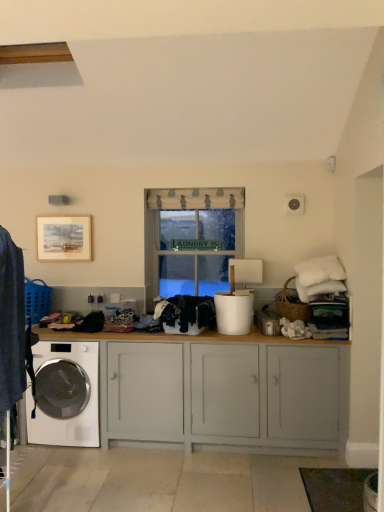
In order to face black cotton clothes at center, which appears as the second clothing when viewed from the left, should I rotate leftwards or rightwards?

Turn left by 1.363 degrees to look at black cotton clothes at center, which appears as the second clothing when viewed from the left.

Where is `white glossy washing machine at lower left`? This screenshot has width=384, height=512. white glossy washing machine at lower left is located at coordinates (81, 412).

Measure the distance between white glossy washing machine at lower left and camera.

The depth of white glossy washing machine at lower left is 10.74 feet.

Locate an element on the screen. denim jacket at left, the first clothing when ordered from front to back is located at coordinates (11, 322).

Identify the location of white fabric at center. (191, 240).

Locate an element on the screen. black cotton clothes at center, the 2th clothing from the front is located at coordinates (186, 314).

Is white glossy washing machine at lower left at the back of matte paper picture frame at upper left?

matte paper picture frame at upper left is not turned away from white glossy washing machine at lower left.

Based on the photo, from a real-world perspective, which object rests below the other?

white glossy washing machine at lower left.

Can you confirm if matte paper picture frame at upper left is smaller than white glossy washing machine at lower left?

Correct, matte paper picture frame at upper left occupies less space than white glossy washing machine at lower left.

Is white painted wood cabinet at center turned away from denim jacket at left, marked as the 1th clothing in a left-to-right arrangement?

white painted wood cabinet at center does not have its back to denim jacket at left, marked as the 1th clothing in a left-to-right arrangement.

From a real-world perspective, count 2nd clothings upward from the white painted wood cabinet at center and point to it. Please provide its 2D coordinates.

[(11, 322)]

Who is bigger, white painted wood cabinet at center or denim jacket at left, the 2th clothing positioned from the right?

With larger size is white painted wood cabinet at center.

Considering the positions of objects white painted wood cabinet at center and denim jacket at left, the first clothing when ordered from front to back, in the image provided, who is more to the left, white painted wood cabinet at center or denim jacket at left, the first clothing when ordered from front to back,?

From the viewer's perspective, denim jacket at left, the first clothing when ordered from front to back, appears more on the left side.

Is denim jacket at left, marked as the 1th clothing in a left-to-right arrangement, at the back of white fabric at center?

Result: No, white fabric at center is not facing the opposite direction of denim jacket at left, marked as the 1th clothing in a left-to-right arrangement.

In the image, is white fabric at center positioned in front of or behind denim jacket at left, marked as the 1th clothing in a left-to-right arrangement?

white fabric at center is behind denim jacket at left, marked as the 1th clothing in a left-to-right arrangement.

How different are the orientations of white fabric at center and denim jacket at left, marked as the 1th clothing in a left-to-right arrangement, in degrees?

There is a 91.2-degree angle between the facing directions of white fabric at center and denim jacket at left, marked as the 1th clothing in a left-to-right arrangement.

Between denim jacket at left, the 2th clothing in the back-to-front sequence, and white painted wood cabinet at center, which one has smaller width?

With smaller width is denim jacket at left, the 2th clothing in the back-to-front sequence.

The image size is (384, 512). Find the location of `cabinetry that appears below the denim jacket at left, the 2th clothing positioned from the right (from the image's perspective)`. cabinetry that appears below the denim jacket at left, the 2th clothing positioned from the right (from the image's perspective) is located at coordinates (222, 391).

Between point (18, 278) and point (212, 401), which one is positioned behind?

Positioned behind is point (212, 401).

From the image's perspective, is denim jacket at left, the first clothing when ordered from front to back, located above white painted wood cabinet at center?

Yes, from the image's perspective, denim jacket at left, the first clothing when ordered from front to back, is on top of white painted wood cabinet at center.

Which is further, (51, 229) or (164, 362)?

The point (51, 229) is farther.

From the image's perspective, which is below, matte paper picture frame at upper left or white painted wood cabinet at center?

From the image's view, white painted wood cabinet at center is below.

Is matte paper picture frame at upper left wider or thinner than white painted wood cabinet at center?

matte paper picture frame at upper left is thinner than white painted wood cabinet at center.

Which of these two, matte paper picture frame at upper left or white painted wood cabinet at center, is bigger?

white painted wood cabinet at center is bigger.

Between white fabric at center and black cotton clothes at center, which appears as the first clothing when viewed from the right, which one has smaller size?

black cotton clothes at center, which appears as the first clothing when viewed from the right.

From a real-world perspective, is white fabric at center physically located above or below black cotton clothes at center, which is the first clothing from back to front?

Clearly, from a real-world perspective, white fabric at center is above black cotton clothes at center, which is the first clothing from back to front.

Considering the positions of objects white fabric at center and black cotton clothes at center, which appears as the second clothing when viewed from the left, in the image provided, who is more to the left, white fabric at center or black cotton clothes at center, which appears as the second clothing when viewed from the left,?

black cotton clothes at center, which appears as the second clothing when viewed from the left.

Relative to black cotton clothes at center, which appears as the first clothing when viewed from the right, is white fabric at center in front or behind?

white fabric at center is behind black cotton clothes at center, which appears as the first clothing when viewed from the right.

From the image's perspective, is white glossy washing machine at lower left located above black cotton clothes at center, the 2th clothing from the front?

No, from the image's perspective, white glossy washing machine at lower left is not above black cotton clothes at center, the 2th clothing from the front.

Is white glossy washing machine at lower left aimed at black cotton clothes at center, which appears as the first clothing when viewed from the right?

No, white glossy washing machine at lower left is not aimed at black cotton clothes at center, which appears as the first clothing when viewed from the right.

Is white glossy washing machine at lower left far from black cotton clothes at center, which appears as the first clothing when viewed from the right?

No, white glossy washing machine at lower left is in close proximity to black cotton clothes at center, which appears as the first clothing when viewed from the right.

Where is `washing machine on the left of black cotton clothes at center, which is the first clothing from back to front`? washing machine on the left of black cotton clothes at center, which is the first clothing from back to front is located at coordinates (81, 412).

Find the location of a particular element. picture frame above the white glossy washing machine at lower left (from a real-world perspective) is located at coordinates (63, 238).

I want to click on cabinetry that is under the denim jacket at left, the 2th clothing positioned from the right (from a real-world perspective), so click(222, 391).

From the image, which object appears to be nearer to white painted wood cabinet at center, black cotton clothes at center, which appears as the first clothing when viewed from the right, or white fabric at center?

black cotton clothes at center, which appears as the first clothing when viewed from the right, is closer to white painted wood cabinet at center.

Based on their spatial positions, is white glossy washing machine at lower left or white fabric at center further from white painted wood cabinet at center?

Among the two, white fabric at center is located further to white painted wood cabinet at center.

When comparing their distances from white fabric at center, does white painted wood cabinet at center or black cotton clothes at center, the 2th clothing from the front, seem closer?

black cotton clothes at center, the 2th clothing from the front.

Looking at the image, which one is located closer to white glossy washing machine at lower left, black cotton clothes at center, which is the first clothing from back to front, or white painted wood cabinet at center?

white painted wood cabinet at center lies closer to white glossy washing machine at lower left than the other object.

Considering their positions, is white painted wood cabinet at center positioned closer to matte paper picture frame at upper left than white fabric at center?

The object closer to matte paper picture frame at upper left is white fabric at center.

Based on their spatial positions, is white fabric at center or denim jacket at left, marked as the 1th clothing in a left-to-right arrangement, further from matte paper picture frame at upper left?

denim jacket at left, marked as the 1th clothing in a left-to-right arrangement, lies further to matte paper picture frame at upper left than the other object.

Looking at this image, estimate the real-world distances between objects in this image. Which object is further from denim jacket at left, the 2th clothing positioned from the right, white glossy washing machine at lower left or white painted wood cabinet at center?

white painted wood cabinet at center is further to denim jacket at left, the 2th clothing positioned from the right.

When comparing their distances from white glossy washing machine at lower left, does matte paper picture frame at upper left or white fabric at center seem closer?

Among the two, matte paper picture frame at upper left is located nearer to white glossy washing machine at lower left.

Locate an element on the screen. washing machine positioned between denim jacket at left, the 2th clothing in the back-to-front sequence, and white fabric at center from near to far is located at coordinates (81, 412).

Image resolution: width=384 pixels, height=512 pixels. In order to click on cabinetry between denim jacket at left, marked as the 1th clothing in a left-to-right arrangement, and white glossy washing machine at lower left, along the z-axis in this screenshot , I will do `click(222, 391)`.

Where is `window between matte paper picture frame at upper left and white glossy washing machine at lower left in the vertical direction`? This screenshot has height=512, width=384. window between matte paper picture frame at upper left and white glossy washing machine at lower left in the vertical direction is located at coordinates (191, 240).

Identify the location of clothing between denim jacket at left, the 2th clothing in the back-to-front sequence, and white fabric at center in the front-back direction. (186, 314).